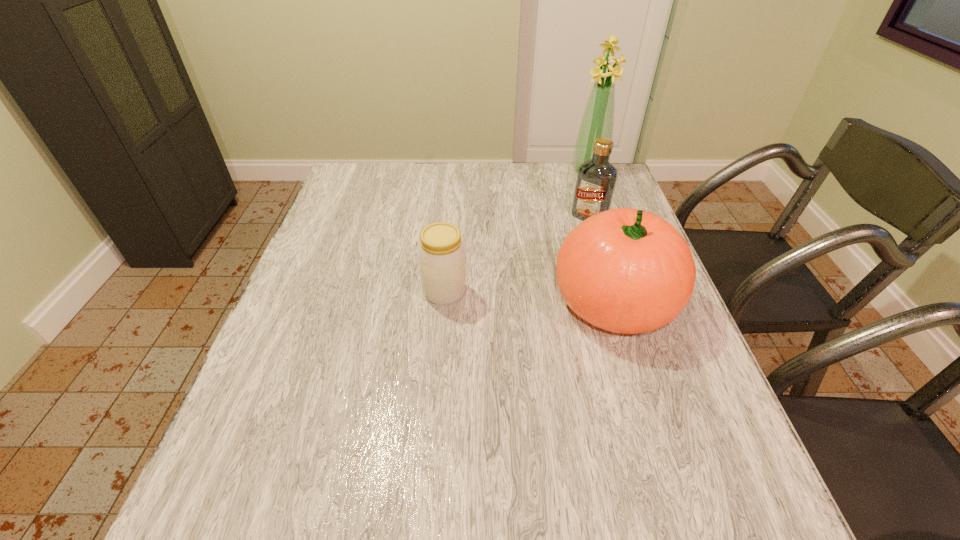
You are a GUI agent. You are given a task and a screenshot of the screen. Output one action in this format:
    pyautogui.click(x=<x>, y=<y>)
    Task: Click on the blank space located 0.210m on the front-facing side of the vodka
    This screenshot has height=540, width=960.
    Given the screenshot: What is the action you would take?
    pyautogui.click(x=548, y=265)

Locate an element on the screen. Image resolution: width=960 pixels, height=540 pixels. vacant space located on the front-facing side of the tallest object is located at coordinates (574, 195).

The height and width of the screenshot is (540, 960). I want to click on vacant space located 0.390m on the front-facing side of the tallest object, so click(x=543, y=247).

Find the location of a particular element. Image resolution: width=960 pixels, height=540 pixels. free spot located 0.360m on the front-facing side of the tallest object is located at coordinates (547, 241).

Locate an element on the screen. object present at the far edge is located at coordinates (598, 119).

Find the location of a particular element. The height and width of the screenshot is (540, 960). pumpkin present at the right edge is located at coordinates (624, 270).

At what (x,y) coordinates should I click in order to perform the action: click on vodka located at the right edge. Please return your answer as a coordinate pair (x, y). The width and height of the screenshot is (960, 540). Looking at the image, I should click on (596, 179).

Where is `bouquet located in the right edge section of the desktop`? This screenshot has width=960, height=540. bouquet located in the right edge section of the desktop is located at coordinates (598, 119).

Image resolution: width=960 pixels, height=540 pixels. In order to click on object that is at the far right corner in this screenshot , I will do `click(598, 119)`.

Where is `free space at the far edge`? This screenshot has height=540, width=960. free space at the far edge is located at coordinates (490, 177).